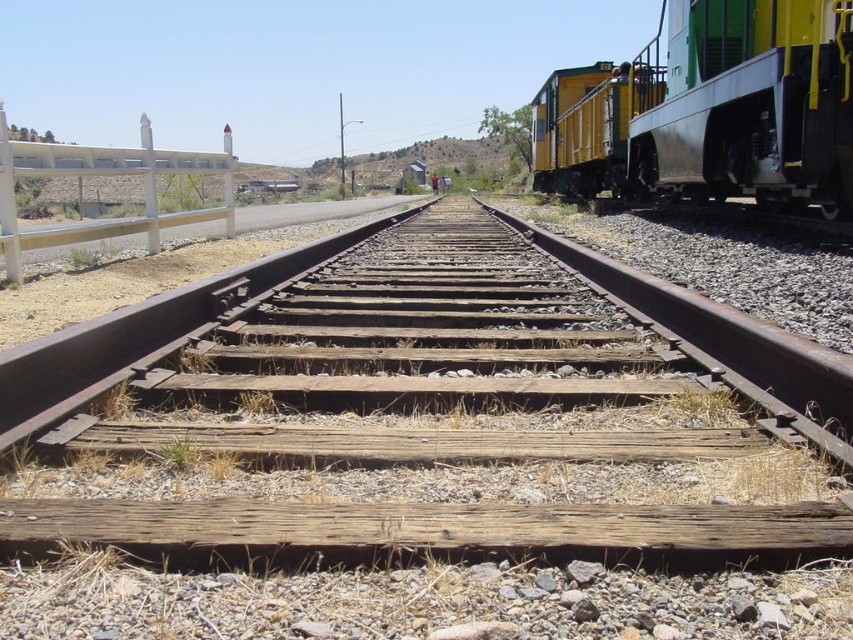
You are standing at the camera position looking at the railway tracks. There is a point marked at coordinates point (758, 333) in the image. If you want to place a 5.5 feet long pole horizontally between the tracks at that point, will it fit without overlapping the tracks?

The distance of point (758, 333) from camera is 6.00 feet. Since the pole is 5.5 feet long, which is shorter than the distance, the pole can be placed horizontally at that point without overlapping the tracks.

You are a maintenance worker who needs to cross from the wooden at center to the white concrete fence at left. The path between them is 19.92 feet wide. If your equipment can only carry items up to 20 feet, can you safely move your tools across without exceeding the weight limit?

The distance between the wooden at center and the white concrete fence at left is 19.92 feet, which is within the 20 feet capacity of your equipment. Therefore, you can safely move your tools across without exceeding the weight limit.